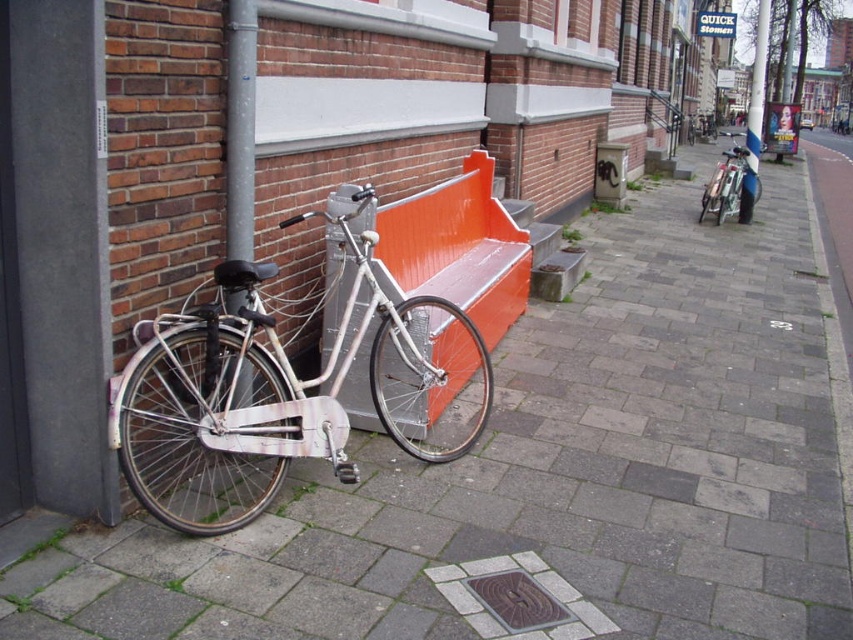
You are a painter standing at the base of the gray metallic pole at left. You want to paint a mural on the wall behind the bicycle and bench. The camera is mounted on a tripod 2.94 meters away from the pole. If your spray can has a maximum reach of 3 meters, can you comfortably reach the wall from your position without moving the tripod?

The gray metallic pole at left and camera are 2.94 meters apart from each other. Since the spray can has a maximum reach of 3 meters, you can comfortably reach the wall from your position without moving the tripod.

Consider the image. You are a delivery person who needs to move a 10 meter long ladder from the silver metallic bicycle at left to the shiny silver bicycle at right. Can you move the ladder without bending it?

The silver metallic bicycle at left and shiny silver bicycle at right are 9.66 meters apart. Since the ladder is 10 meters long, it is longer than the distance between them, so you cannot move the ladder without bending it.

You are standing in the urban street scene described. You want to take a photo of the orange glossy bench at center from a distance that ensures it appears large and clear in the photo. Considering the bench is 11.81 feet away, would you need to use a zoom lens to capture it effectively?

A: The orange glossy bench at center is 11.81 feet away from the camera. To ensure it appears large and clear in the photo, using a zoom lens would help bring the bench into focus and frame it properly.